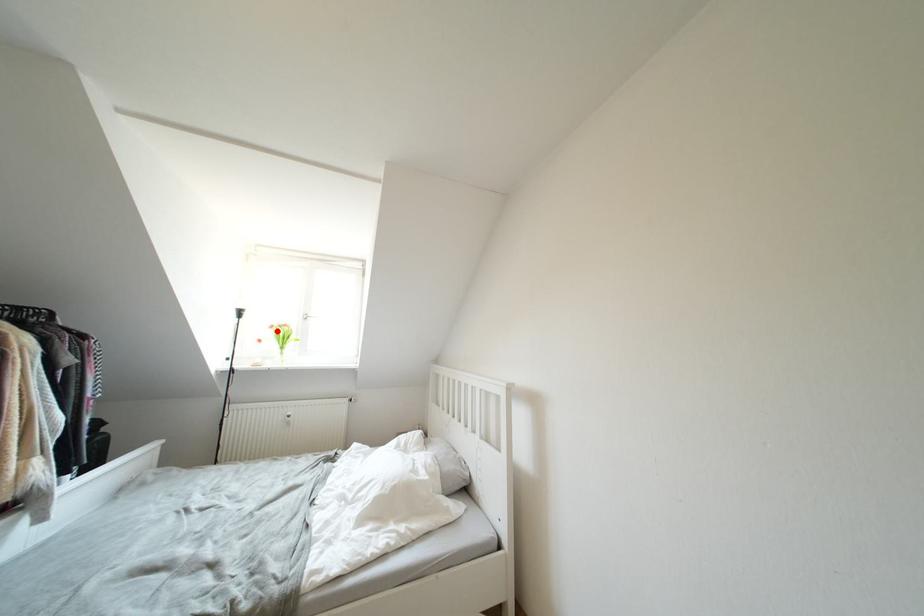
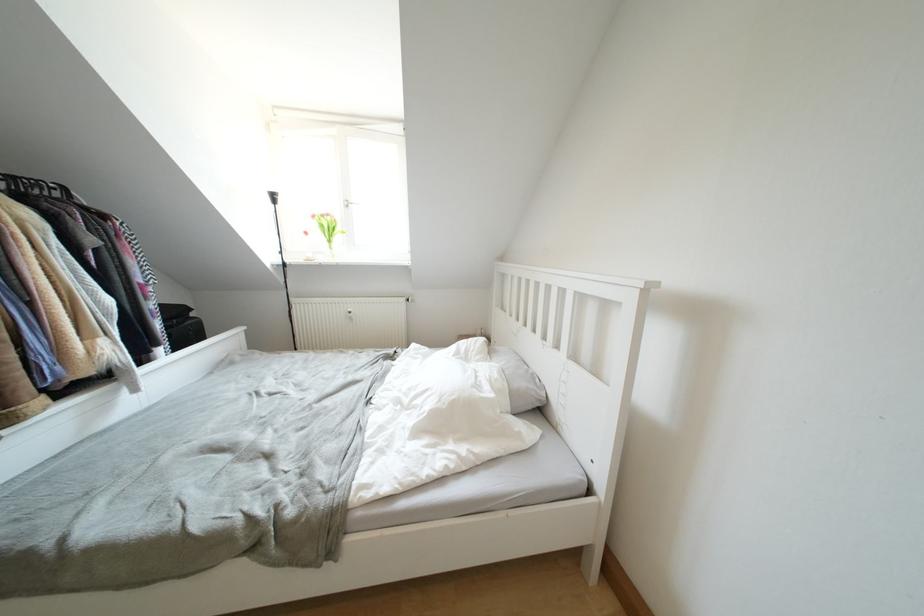
Question: A red point is marked in image1. In image2, is the corresponding 3D point closer to the camera or farther? Reply with the corresponding letter.

Choices:
 (A) The corresponding 3D point is closer.
 (B) The corresponding 3D point is farther.

Answer: (A)